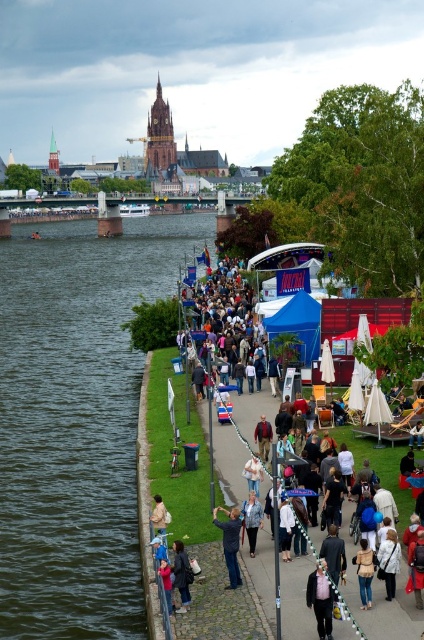
Does matte black jacket at center have a greater height compared to dark blue jeans at lower center?

Correct, matte black jacket at center is much taller as dark blue jeans at lower center.

Does matte black jacket at center appear over dark blue jeans at lower center?

Incorrect, matte black jacket at center is not positioned above dark blue jeans at lower center.

Does point (329, 616) come in front of point (184, 611)?

That is True.

Identify the location of matte black jacket at center. (320, 600).

Does point (370, 604) come behind point (251, 524)?

No.

Is point (362, 572) more distant than point (245, 502)?

No, it is not.

At what (x,y) coordinates should I click in order to perform the action: click on light brown leather jacket at lower center. Please return your answer as a coordinate pair (x, y). Looking at the image, I should click on (365, 572).

Between matte black jacket at center and dark blue jeans at center, which one is positioned higher?

dark blue jeans at center

Does matte black jacket at center have a larger size compared to dark blue jeans at center?

No.

Which is behind, point (320, 616) or point (234, 556)?

The point (234, 556) is more distant.

Where is `matte black jacket at center`? matte black jacket at center is located at coordinates (320, 600).